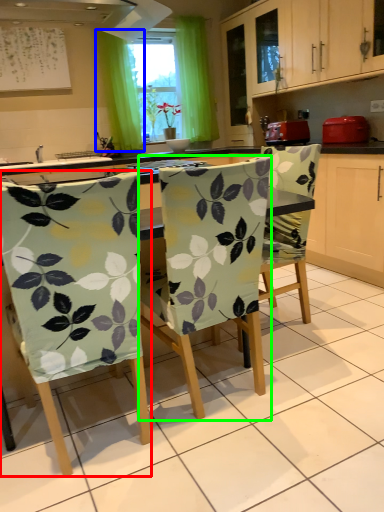
Question: Estimate the real-world distances between objects in this image. Which object is closer to chair (highlighted by a red box), curtain (highlighted by a blue box) or chair (highlighted by a green box)?

Choices:
 (A) curtain
 (B) chair

Answer: (B)